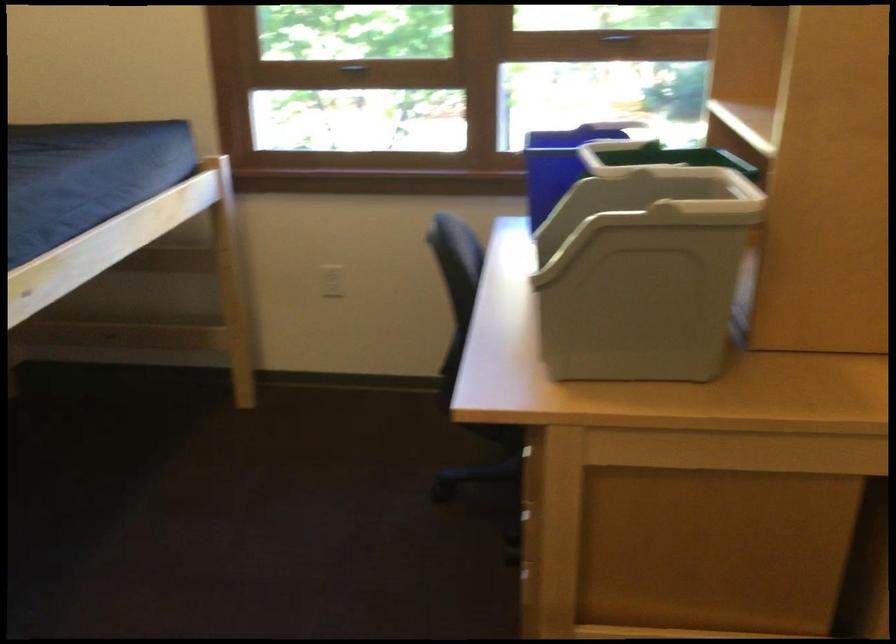
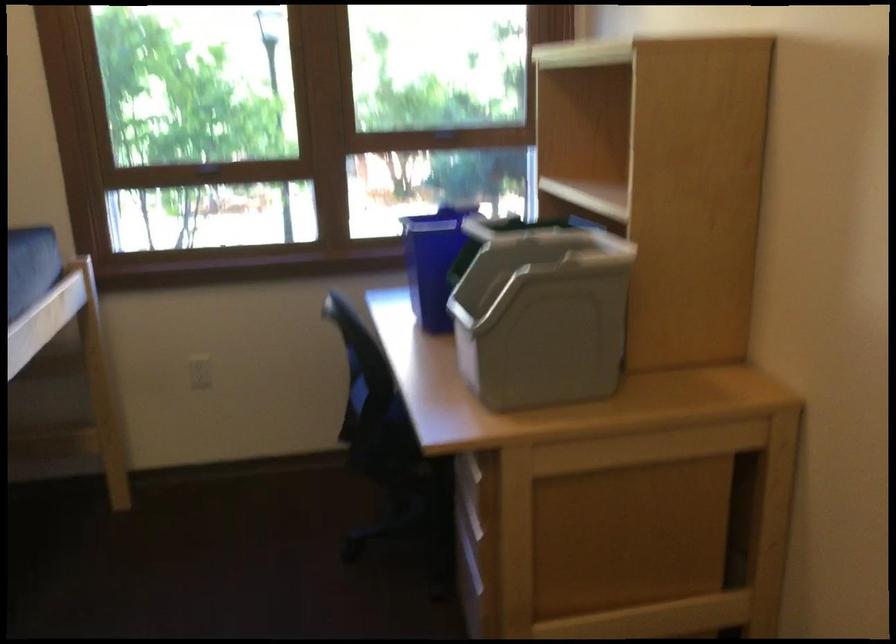
Question: The camera is either moving clockwise (left) or counter-clockwise (right) around the object. The first image is from the beginning of the video and the second image is from the end. Is the camera moving left or right when shooting the video?

Choices:
 (A) Left
 (B) Right

Answer: (A)